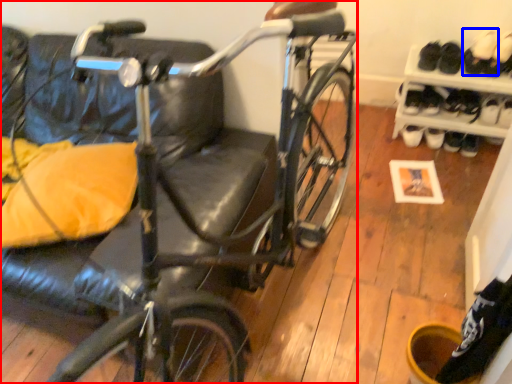
Question: Which point is closer to the camera, bicycle (highlighted by a red box) or footwear (highlighted by a blue box)?

Choices:
 (A) bicycle
 (B) footwear

Answer: (A)